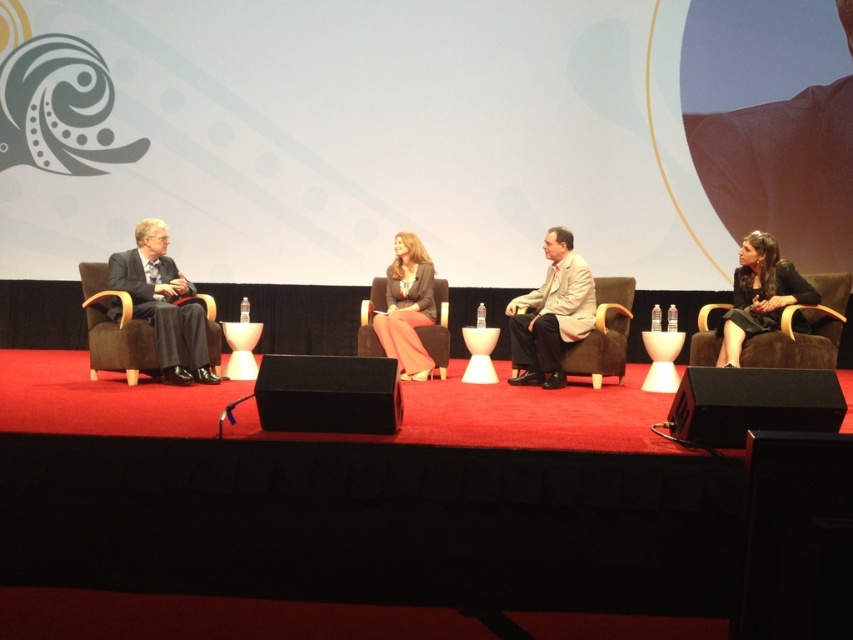
Is point (802, 280) more distant than point (128, 316)?

No, it is in front of (128, 316).

Between point (752, 280) and point (107, 301), which one is positioned behind?

The point (107, 301) is behind.

I want to click on black fabric dress at right, so click(x=759, y=294).

Looking at this image, is light brown fabric armchair at center to the right of suede-like brown armchair at center from the viewer's perspective?

Yes, light brown fabric armchair at center is to the right of suede-like brown armchair at center.

From the picture: Which of these two, light brown fabric armchair at center or suede-like brown armchair at center, stands taller?

Standing taller between the two is light brown fabric armchair at center.

Which is behind, point (514, 365) or point (383, 355)?

Point (383, 355)

Where is `light brown fabric armchair at center`? This screenshot has width=853, height=640. light brown fabric armchair at center is located at coordinates (602, 333).

Is black fabric dress at right taller than suede-like brown armchair at center?

Indeed, black fabric dress at right has a greater height compared to suede-like brown armchair at center.

Which is behind, point (770, 237) or point (378, 282)?

Positioned behind is point (378, 282).

Is point (751, 292) positioned after point (448, 340)?

No, (751, 292) is in front of (448, 340).

Identify the location of black fabric dress at right. (759, 294).